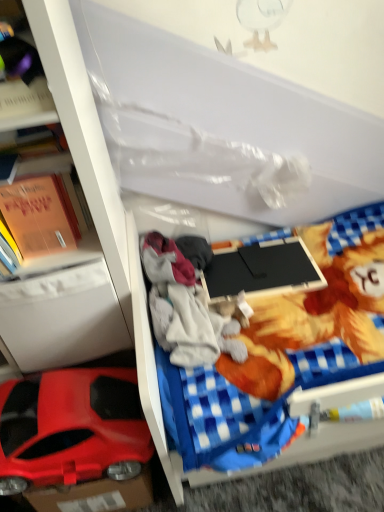
At what (x,y) coordinates should I click in order to perform the action: click on gray fleece hoodie at center. Please return your answer as a coordinate pair (x, y). This screenshot has width=384, height=512. Looking at the image, I should click on (177, 303).

In order to face orange paper book at left, should I rotate leftwards or rightwards?

A 22.025 degree turn to the left will do.

Where is `white plastic drawer at left`? white plastic drawer at left is located at coordinates (62, 317).

I want to click on gray fleece hoodie at center, so click(x=177, y=303).

From the image's perspective, is blue checkered bed frame at center above or below black matte laptop at center?

From the image's perspective, blue checkered bed frame at center appears below black matte laptop at center.

Is point (143, 307) behind point (323, 282)?

No, it is in front of (323, 282).

Considering the sizes of objects blue checkered bed frame at center and black matte laptop at center in the image provided, who is shorter, blue checkered bed frame at center or black matte laptop at center?

Standing shorter between the two is black matte laptop at center.

Which object is positioned more to the right, blue checkered bed frame at center or black matte laptop at center?

From the viewer's perspective, blue checkered bed frame at center appears more on the right side.

In the scene shown: Considering their positions, is white plastic drawer at left located in front of or behind blue checkered bed frame at center?

white plastic drawer at left is positioned farther from the viewer than blue checkered bed frame at center.

Is point (109, 342) closer or farther from the camera than point (159, 434)?

Clearly, point (109, 342) is more distant from the camera than point (159, 434).

Is white plastic drawer at left aimed at blue checkered bed frame at center?

No, white plastic drawer at left is not turned towards blue checkered bed frame at center.

Which of these two, white plastic drawer at left or blue checkered bed frame at center, is bigger?

blue checkered bed frame at center.

Based on the photo, is gray fleece hoodie at center thinner than white plastic bookshelf at left?

Indeed, gray fleece hoodie at center has a lesser width compared to white plastic bookshelf at left.

From a real-world perspective, is gray fleece hoodie at center on white plastic bookshelf at left?

Actually, gray fleece hoodie at center is physically below white plastic bookshelf at left in the real world.

Is gray fleece hoodie at center spatially inside white plastic bookshelf at left, or outside of it?

gray fleece hoodie at center lies outside white plastic bookshelf at left.

Which is less distant, (161, 330) or (102, 240)?

Clearly, point (161, 330) is more distant from the camera than point (102, 240).

Are white plastic bookshelf at left and shiny plastic car at lower left far apart?

No.

Would you say white plastic bookshelf at left is outside shiny plastic car at lower left?

white plastic bookshelf at left lies outside shiny plastic car at lower left's area.

From the picture: Is white plastic bookshelf at left further to camera compared to shiny plastic car at lower left?

No, it is in front of shiny plastic car at lower left.

Based on their positions, is white plastic bookshelf at left located to the left or right of shiny plastic car at lower left?

From the image, it's evident that white plastic bookshelf at left is to the left of shiny plastic car at lower left.

From the picture: From the image's perspective, relative to orange paper book at left, is blue checkered bed frame at center above or below?

blue checkered bed frame at center is situated lower than orange paper book at left in the image.

Is blue checkered bed frame at center outside of orange paper book at left?

Yes, blue checkered bed frame at center is outside of orange paper book at left.

Considering the points (131, 264) and (48, 251), which point is behind, point (131, 264) or point (48, 251)?

The point (131, 264) is behind.

You are a GUI agent. You are given a task and a screenshot of the screen. Output one action in this format:
    pyautogui.click(x=<x>, y=<y>)
    Task: Click on the book that is on the left side of blue checkered bed frame at center
    
    Given the screenshot: What is the action you would take?
    pyautogui.click(x=40, y=216)

Which is less distant, (212, 352) or (129, 445)?

Point (212, 352) is farther from the camera than point (129, 445).

Can you see gray fleece hoodie at center touching shiny plastic car at lower left?

No, gray fleece hoodie at center is not with shiny plastic car at lower left.

Considering the relative sizes of gray fleece hoodie at center and shiny plastic car at lower left in the image provided, is gray fleece hoodie at center shorter than shiny plastic car at lower left?

Yes, gray fleece hoodie at center is shorter than shiny plastic car at lower left.

Between black matte laptop at center and orange paper book at left, which one is positioned in front?

orange paper book at left is in front.

Would you say orange paper book at left is part of black matte laptop at center's contents?

No, black matte laptop at center does not contain orange paper book at left.

What's the angular difference between black matte laptop at center and orange paper book at left's facing directions?

The facing directions of black matte laptop at center and orange paper book at left are 2.1 degrees apart.

This screenshot has height=512, width=384. Find the location of `laptop that appears above the blue checkered bed frame at center (from the image's perspective)`. laptop that appears above the blue checkered bed frame at center (from the image's perspective) is located at coordinates (264, 270).

Locate an element on the screen. drawer above the blue checkered bed frame at center (from a real-world perspective) is located at coordinates (62, 317).

Estimate the real-world distances between objects in this image. Which object is closer to orange paper book at left, white plastic bookshelf at left or white plastic drawer at left?

The object closer to orange paper book at left is white plastic bookshelf at left.

Which object lies nearer to the anchor point orange paper book at left, blue checkered bed frame at center or white plastic drawer at left?

Based on the image, white plastic drawer at left appears to be nearer to orange paper book at left.

Consider the image. When comparing their distances from white plastic drawer at left, does shiny plastic car at lower left or black matte laptop at center seem closer?

shiny plastic car at lower left lies closer to white plastic drawer at left than the other object.

Which object lies nearer to the anchor point orange paper book at left, white plastic bookshelf at left or gray fleece hoodie at center?

Based on the image, white plastic bookshelf at left appears to be nearer to orange paper book at left.

Estimate the real-world distances between objects in this image. Which object is closer to orange paper book at left, black matte laptop at center or white plastic bookshelf at left?

white plastic bookshelf at left is positioned closer to the anchor orange paper book at left.

Which object lies nearer to the anchor point black matte laptop at center, blue checkered bed frame at center or orange paper book at left?

blue checkered bed frame at center lies closer to black matte laptop at center than the other object.

Estimate the real-world distances between objects in this image. Which object is further from blue checkered bed frame at center, gray fleece hoodie at center or orange paper book at left?

The object further to blue checkered bed frame at center is orange paper book at left.

Based on the photo, which object lies further to the anchor point white plastic bookshelf at left, white plastic drawer at left or black matte laptop at center?

The object further to white plastic bookshelf at left is black matte laptop at center.

The width and height of the screenshot is (384, 512). Identify the location of book situated between white plastic bookshelf at left and gray fleece hoodie at center from left to right. (40, 216).

I want to click on clothing situated between white plastic drawer at left and blue checkered bed frame at center from left to right, so click(177, 303).

The width and height of the screenshot is (384, 512). What are the coordinates of `clothing between white plastic bookshelf at left and black matte laptop at center` in the screenshot? It's located at (177, 303).

The height and width of the screenshot is (512, 384). I want to click on drawer between white plastic bookshelf at left and gray fleece hoodie at center in the horizontal direction, so click(62, 317).